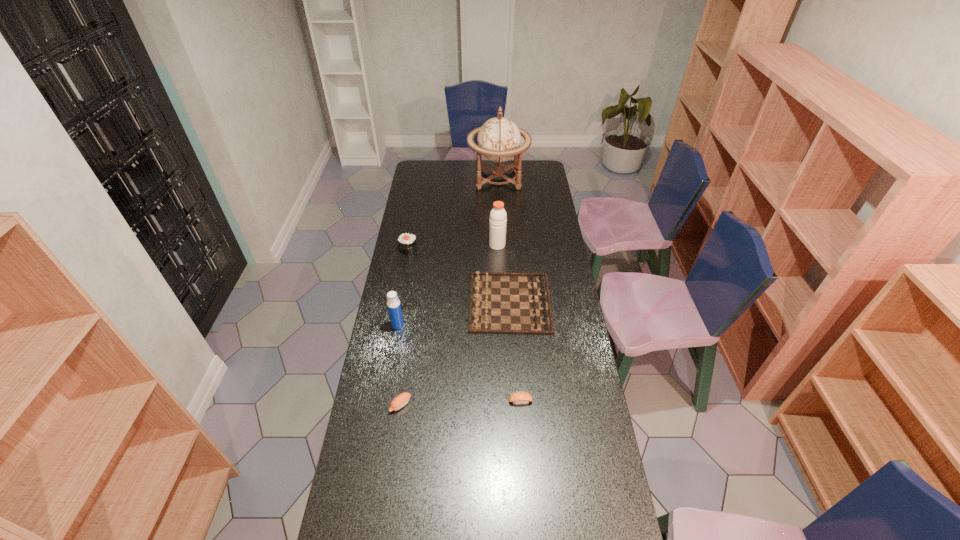
The height and width of the screenshot is (540, 960). In order to click on free space located at the front of the farthest object showing Africa in this screenshot , I will do `click(439, 178)`.

At what (x,y) coordinates should I click in order to perform the action: click on free space located at the front of the farthest object showing Africa. Please return your answer as a coordinate pair (x, y). Looking at the image, I should click on (435, 178).

Where is `free space located 0.080m on the left of the second tallest object`? This screenshot has width=960, height=540. free space located 0.080m on the left of the second tallest object is located at coordinates (472, 245).

The width and height of the screenshot is (960, 540). Find the location of `free location located on the right of the water bottle`. free location located on the right of the water bottle is located at coordinates (458, 325).

Image resolution: width=960 pixels, height=540 pixels. I want to click on free space located 0.170m on the left of the chessboard, so click(x=429, y=302).

Image resolution: width=960 pixels, height=540 pixels. What are the coordinates of `vacant region located on the back of the tallest sushi` in the screenshot? It's located at (415, 217).

Locate an element on the screen. Image resolution: width=960 pixels, height=540 pixels. vacant region located on the back of the second tallest sushi is located at coordinates (408, 356).

The height and width of the screenshot is (540, 960). I want to click on vacant space located on the front of the shortest object, so click(524, 459).

Identify the location of object present at the far edge. The image size is (960, 540). (498, 139).

The image size is (960, 540). I want to click on water bottle present at the left edge, so click(x=393, y=303).